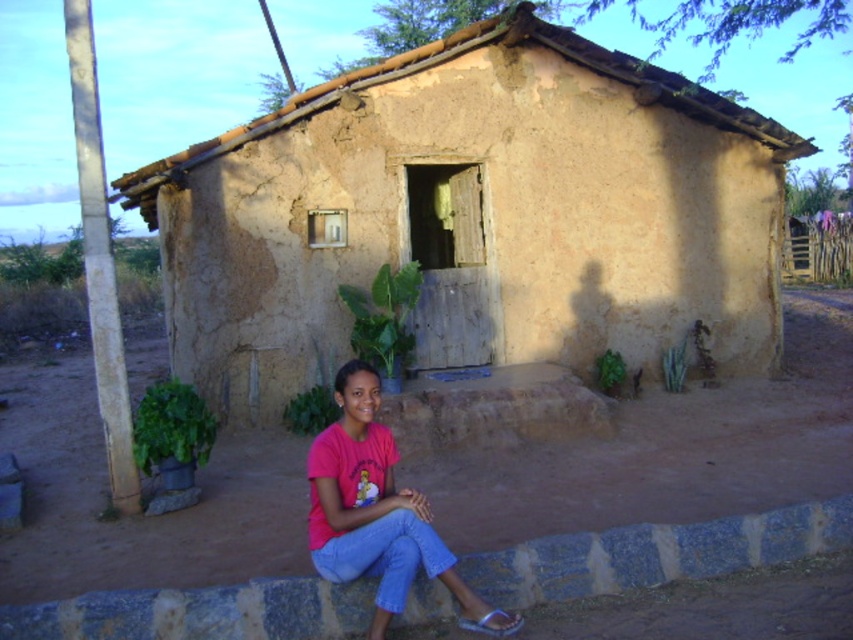
Is brown mud hut at center to the right of brown dirt field at center from the viewer's perspective?

Indeed, brown mud hut at center is positioned on the right side of brown dirt field at center.

Locate an element on the screen. brown mud hut at center is located at coordinates (473, 216).

This screenshot has height=640, width=853. Identify the location of brown mud hut at center. (473, 216).

Is brown dirt field at center closer to camera compared to pink matte shirt at center?

No.

Does brown dirt field at center appear on the left side of pink matte shirt at center?

No, brown dirt field at center is not to the left of pink matte shirt at center.

Locate an element on the screen. The height and width of the screenshot is (640, 853). brown dirt field at center is located at coordinates (664, 480).

Which is more to the left, brown mud hut at center or pink matte shirt at center?

pink matte shirt at center is more to the left.

Who is lower down, brown mud hut at center or pink matte shirt at center?

pink matte shirt at center is lower down.

Is point (229, 218) behind point (351, 536)?

Yes, it is behind point (351, 536).

Identify the location of brown mud hut at center. The image size is (853, 640). (473, 216).